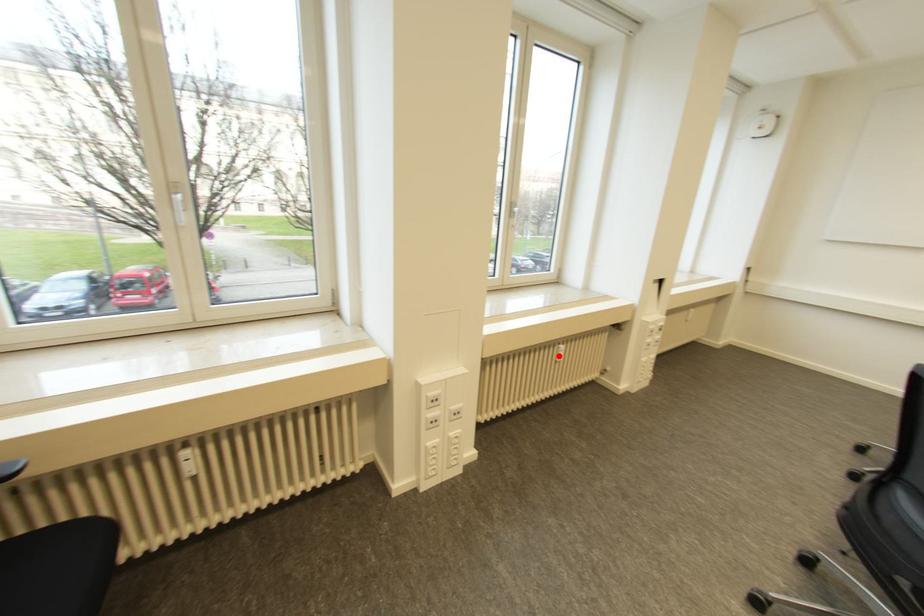
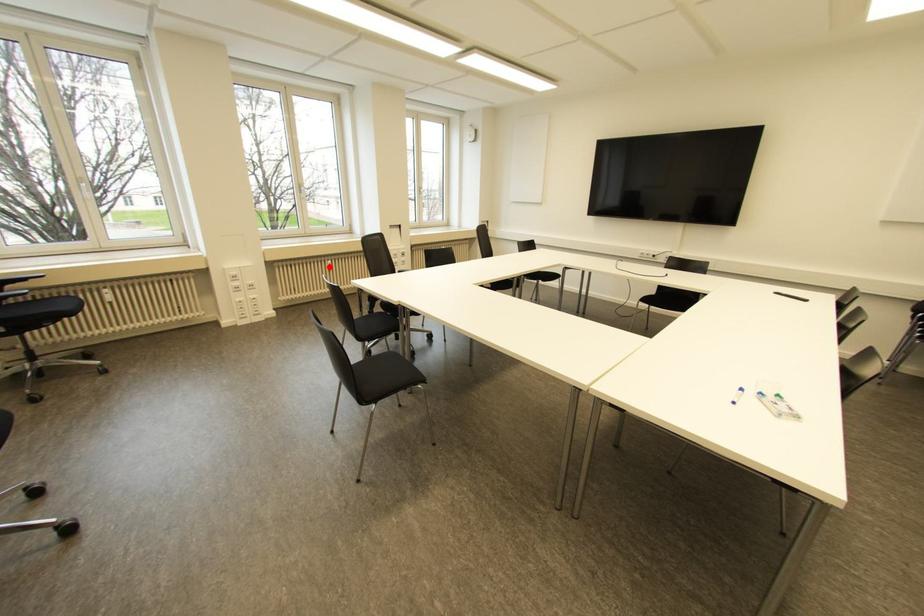
I am providing you with two images of the same scene from different viewpoints. A red point is marked on the first image and another point is marked on the second image. Does the point marked in image1 correspond to the same location as the one in image2?

Yes